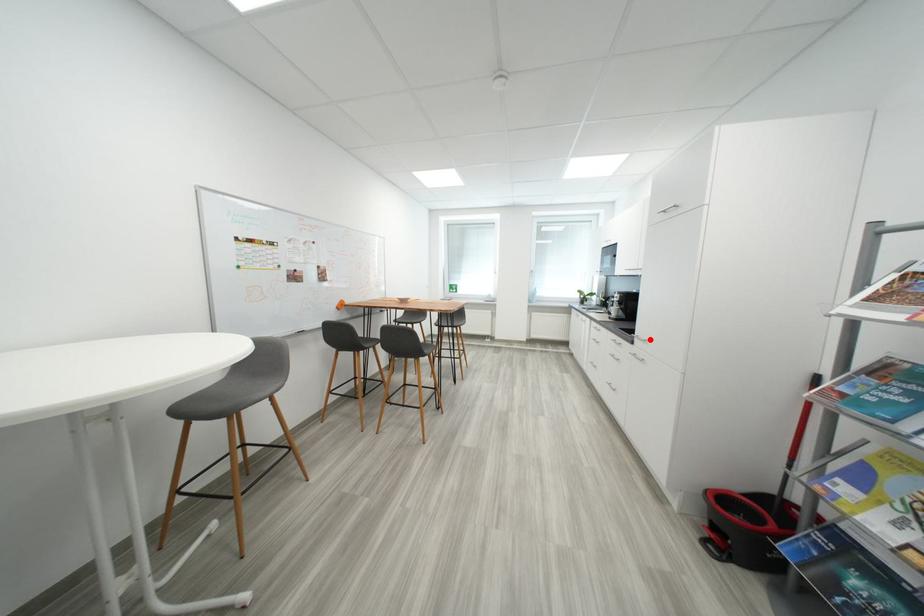
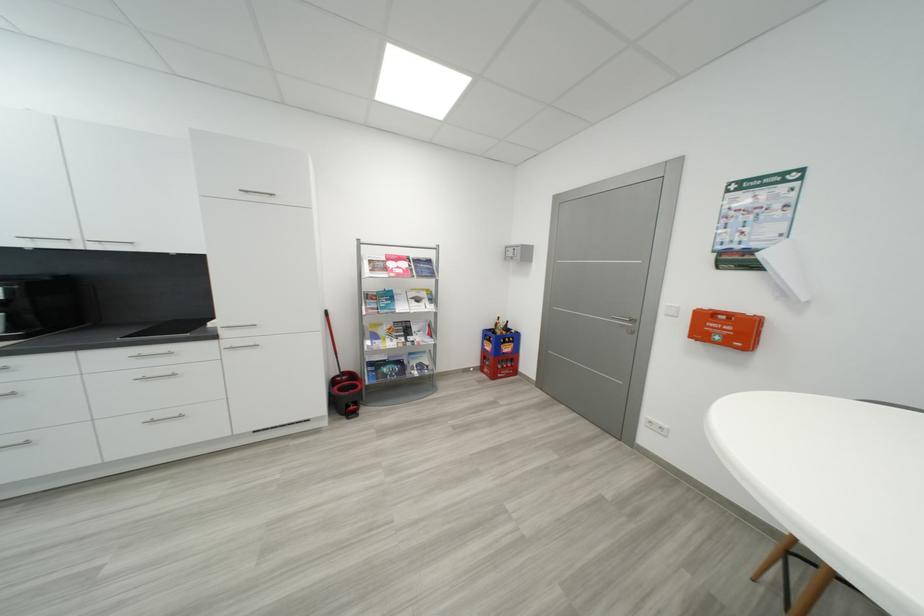
Find the pixel in the second image that matches the highlighted location in the first image.

(256, 325)